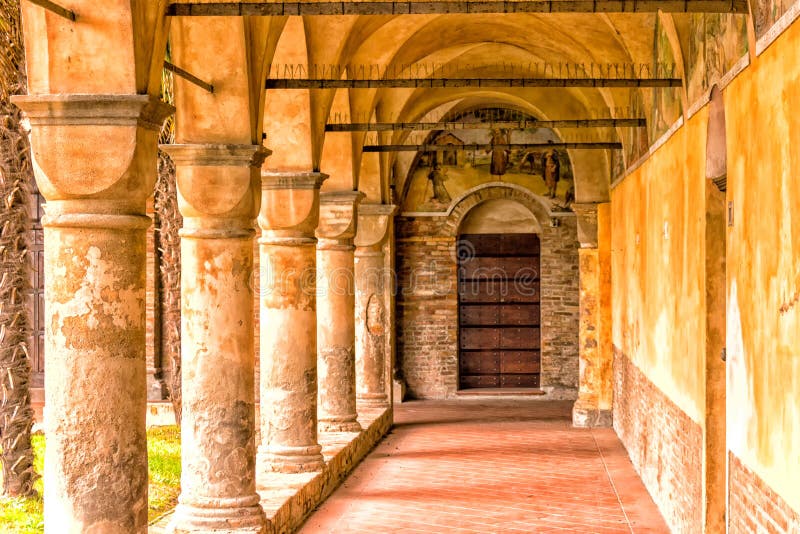
Where is `door`? The height and width of the screenshot is (534, 800). door is located at coordinates point(494,290).